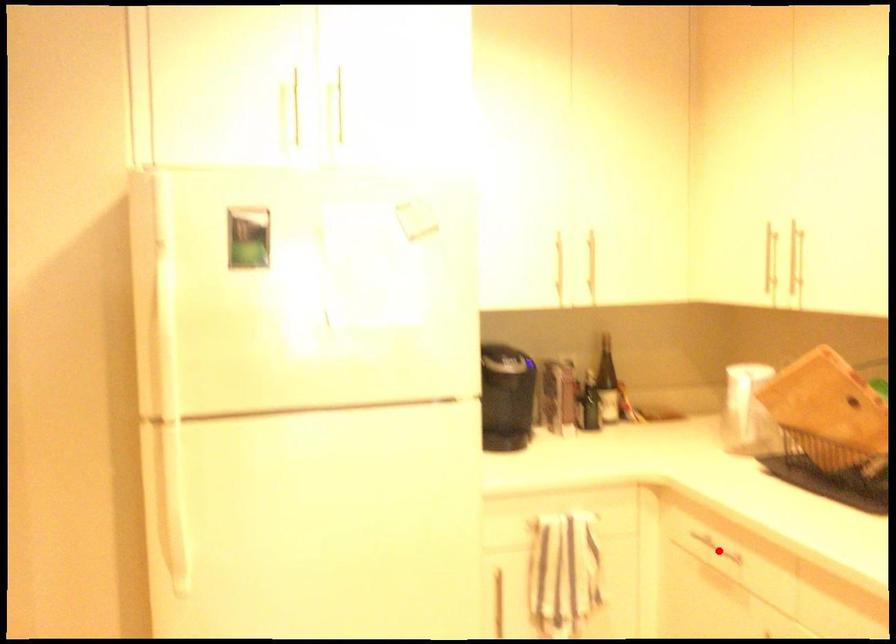
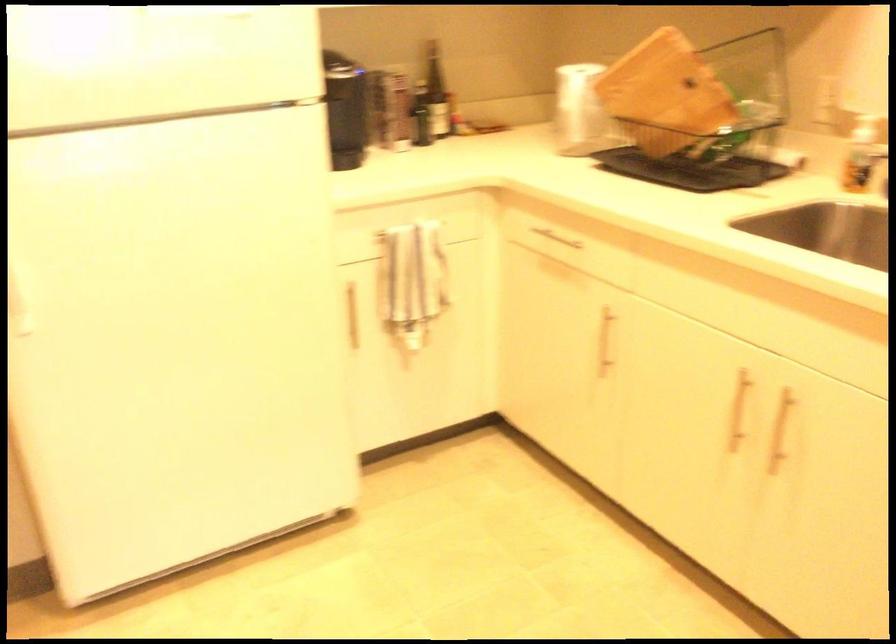
Find the pixel in the second image that matches the highlighted location in the first image.

(554, 238)